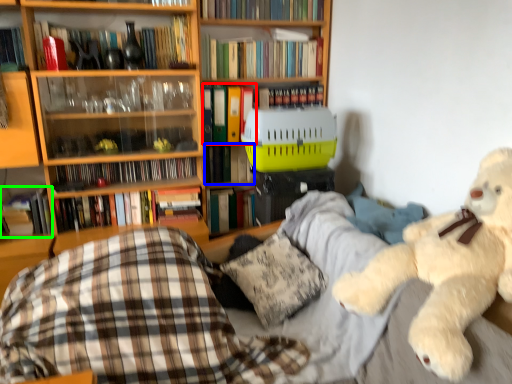
Question: Based on their relative distances, which object is farther from book (highlighted by a red box)? Choose from book (highlighted by a blue box) and book (highlighted by a green box).

Choices:
 (A) book
 (B) book

Answer: (B)